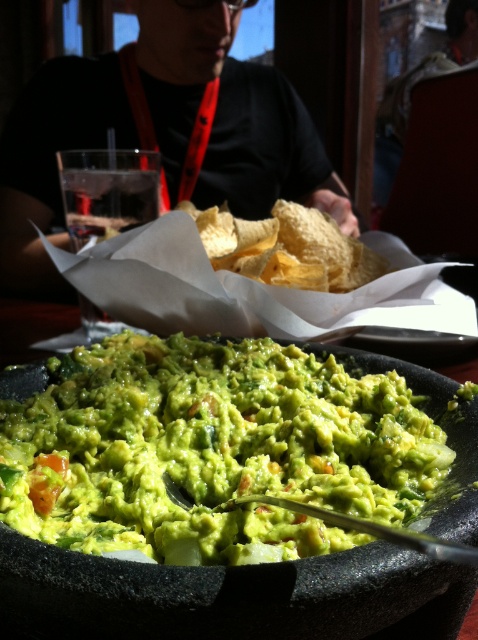
Is green creamy guacamole at center behind black shirt at upper center?

No, it is in front of black shirt at upper center.

Consider the image. Between green creamy guacamole at center and black shirt at upper center, which one appears on the left side from the viewer's perspective?

black shirt at upper center is more to the left.

Describe the element at coordinates (214, 449) in the screenshot. I see `green creamy guacamole at center` at that location.

The width and height of the screenshot is (478, 640). I want to click on green creamy guacamole at center, so click(214, 449).